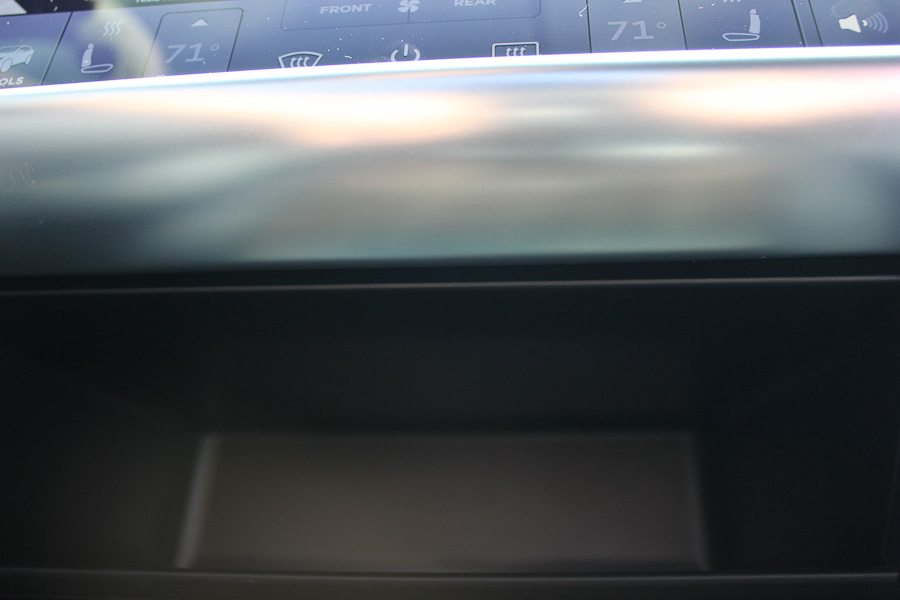
The width and height of the screenshot is (900, 600). What are the coordinates of `heated seat icon button` in the screenshot? It's located at (86, 54).